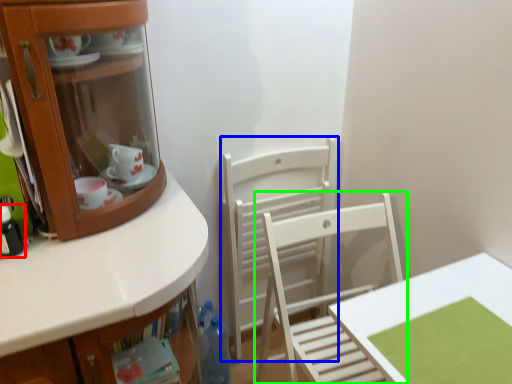
Question: Based on their relative distances, which object is nearer to bottle (highlighted by a red box)? Choose from chair (highlighted by a blue box) and chair (highlighted by a green box).

Choices:
 (A) chair
 (B) chair

Answer: (B)